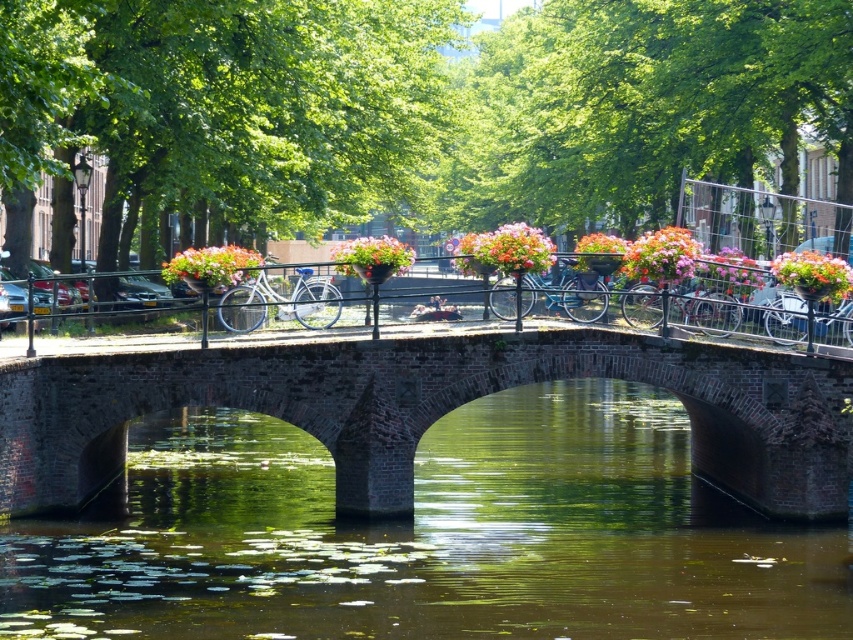
You are a tourist standing on the brick bridge and want to take a photo of both the floral basket at center and the pastel pink fabric basket at center. Which basket should you focus on first if you want to capture them from left to right in the frame?

The floral basket at center should be focused on first since it is positioned to the left of the pastel pink fabric basket at center, aligning with the left to right order in the frame.

You are a cyclist standing on the brick bridge and want to place a new flower basket between the existing floral basket at center and the pastel pink fabric basket at center. Based on their positions, where should you place it?

The floral basket at center is above the pastel pink fabric basket at center. To place a new flower basket between them, position it below the floral basket at center and above the pastel pink fabric basket at center.

You are standing on the brick bridge and want to place a small decoration exactly at point (x=372, y=253). According to the scene description, where should you place it?

The point (x=372, y=253) is on the floral basket at center, so you should place the decoration there.